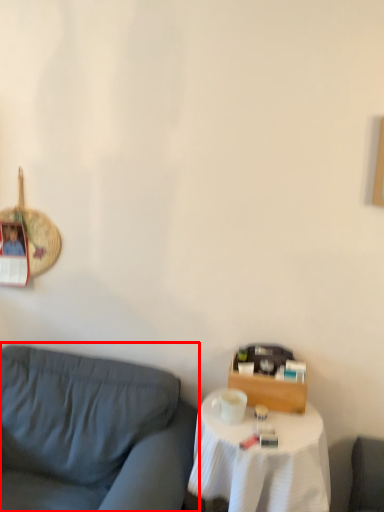
Question: Observing the image, what is the correct spatial positioning of studio couch (annotated by the red box) in reference to table?

Choices:
 (A) left
 (B) right

Answer: (A)